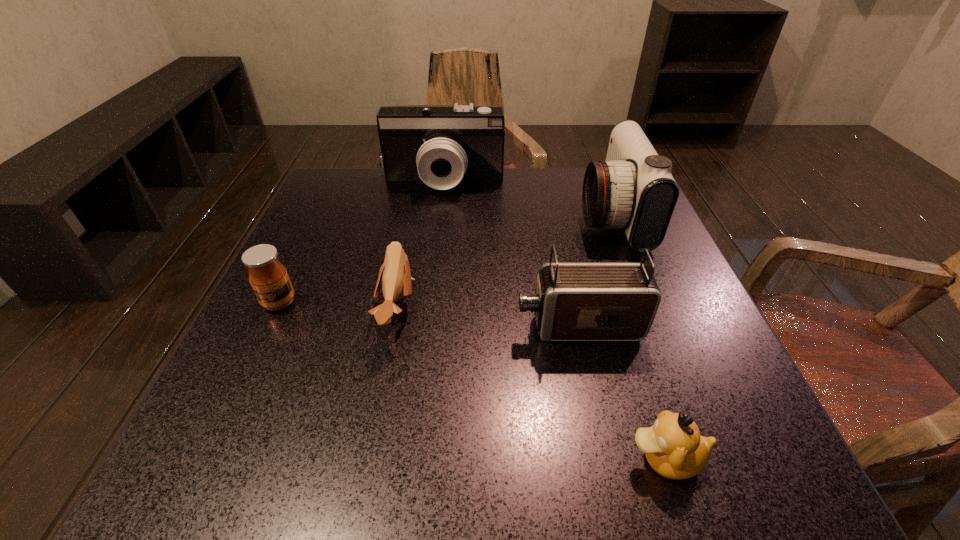
The width and height of the screenshot is (960, 540). I want to click on vacant space that is in between the bird and the leftmost camcorder, so click(421, 246).

Where is `free space between the nearest camcorder and the duckling`? The width and height of the screenshot is (960, 540). free space between the nearest camcorder and the duckling is located at coordinates (622, 393).

At what (x,y) coordinates should I click in order to perform the action: click on vacant area that lies between the bird and the leftmost object. Please return your answer as a coordinate pair (x, y). The width and height of the screenshot is (960, 540). Looking at the image, I should click on (338, 306).

Where is `free space between the honey and the nearest camcorder`? This screenshot has width=960, height=540. free space between the honey and the nearest camcorder is located at coordinates (429, 314).

You are a GUI agent. You are given a task and a screenshot of the screen. Output one action in this format:
    pyautogui.click(x=<x>, y=<y>)
    Task: Click on the closest object to the leftmost camcorder
    
    Given the screenshot: What is the action you would take?
    (633, 189)

Locate which object is the third closest to the bird. Please provide its 2D coordinates. Your answer should be formatted as a tuple, i.e. [(x, y)], where the tuple contains the x and y coordinates of a point satisfying the conditions above.

[(440, 145)]

The width and height of the screenshot is (960, 540). I want to click on the second closest camcorder to the duckling, so click(633, 189).

You are a GUI agent. You are given a task and a screenshot of the screen. Output one action in this format:
    pyautogui.click(x=<x>, y=<y>)
    Task: Click on the camcorder that is the second closest to the leftmost camcorder
    The width and height of the screenshot is (960, 540).
    Given the screenshot: What is the action you would take?
    pyautogui.click(x=573, y=301)

You are a GUI agent. You are given a task and a screenshot of the screen. Output one action in this format:
    pyautogui.click(x=<x>, y=<y>)
    Task: Click on the free spot that satisfies the following two spatial constraints: 1. on the lens of the leftmost camcorder; 2. at the beak of the bird
    This screenshot has height=540, width=960.
    Given the screenshot: What is the action you would take?
    pyautogui.click(x=430, y=310)

Identify the location of free location that satisfies the following two spatial constraints: 1. on the lens of the leftmost camcorder; 2. at the beak of the bird. The image size is (960, 540). (430, 310).